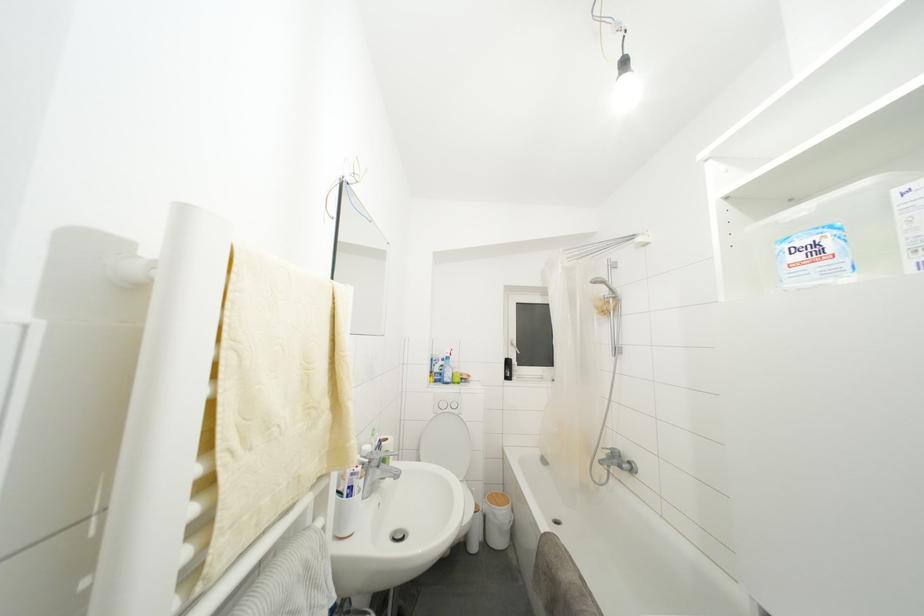
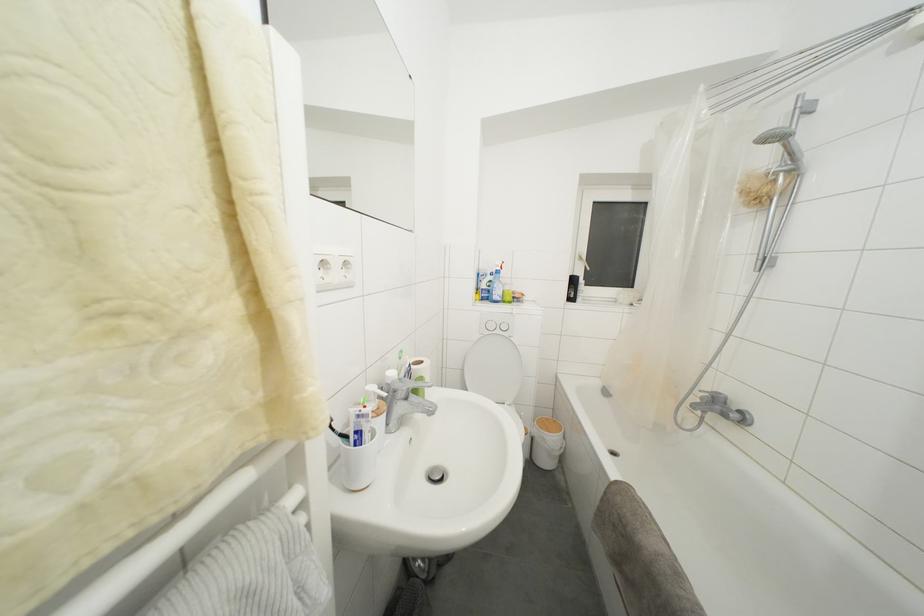
Find the pixel in the second image that matches point 468,384 in the first image.

(520, 304)